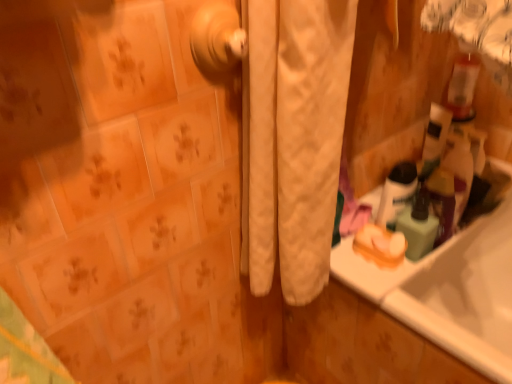
Question: Based on their positions, is white quilted curtain at center located to the left or right of translucent plastic soap dispenser at right?

Choices:
 (A) right
 (B) left

Answer: (B)

Question: Would you say white quilted curtain at center is inside or outside translucent plastic soap dispenser at right?

Choices:
 (A) inside
 (B) outside

Answer: (B)

Question: Estimate the real-world distances between objects in this image. Which object is closer to the white quilted curtain at center?

Choices:
 (A) white glossy mouthwash at upper right
 (B) translucent plastic soap dispenser at right
 (C) polished brass door handle at center

Answer: (C)

Question: Estimate the real-world distances between objects in this image. Which object is farther from the white quilted curtain at center?

Choices:
 (A) polished brass door handle at center
 (B) white glossy mouthwash at upper right
 (C) translucent plastic soap dispenser at right

Answer: (C)